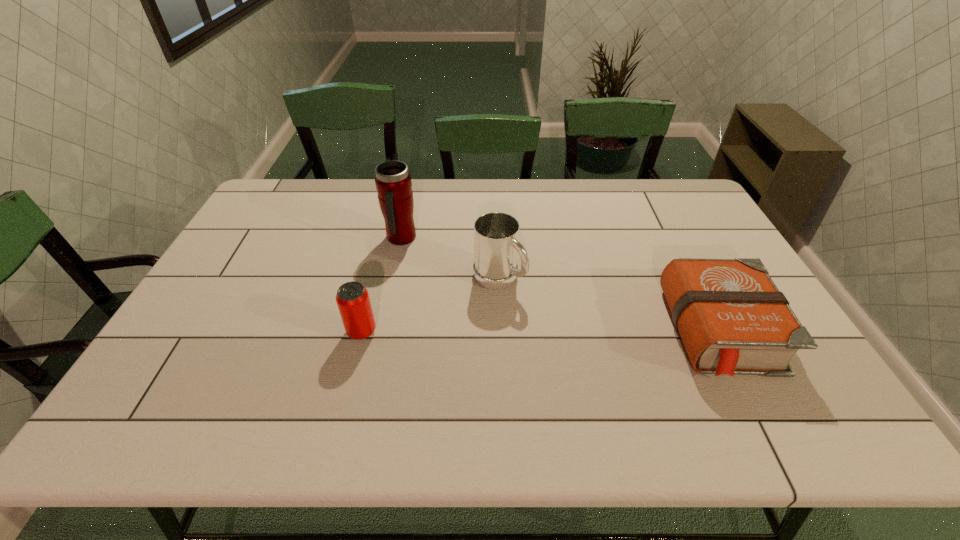
Identify the location of vacant space located on the side with the handle of the thermos bottle. The height and width of the screenshot is (540, 960). (444, 286).

At what (x,y) coordinates should I click in order to perform the action: click on vacant space situated 0.180m on the side with the handle of the thermos bottle. Please return your answer as a coordinate pair (x, y). The image size is (960, 540). Looking at the image, I should click on (441, 282).

You are a GUI agent. You are given a task and a screenshot of the screen. Output one action in this format:
    pyautogui.click(x=<x>, y=<y>)
    Task: Click on the free location located 0.320m on the side of the second tallest object with the handle
    This screenshot has width=960, height=540.
    Given the screenshot: What is the action you would take?
    pyautogui.click(x=611, y=364)

Locate an element on the screen. The image size is (960, 540). vacant area situated 0.340m on the side of the second tallest object with the handle is located at coordinates (618, 369).

In order to click on free space located 0.190m on the side of the second tallest object with the handle in this screenshot , I will do `click(569, 332)`.

This screenshot has height=540, width=960. I want to click on object located in the near edge section of the desktop, so click(732, 319).

Identify the location of object at the right edge. (732, 319).

This screenshot has height=540, width=960. Identify the location of object located at the near right corner. (732, 319).

Find the location of `vacant space at the far edge`. vacant space at the far edge is located at coordinates (446, 192).

This screenshot has height=540, width=960. Identify the location of vacant space at the near edge of the desktop. (613, 381).